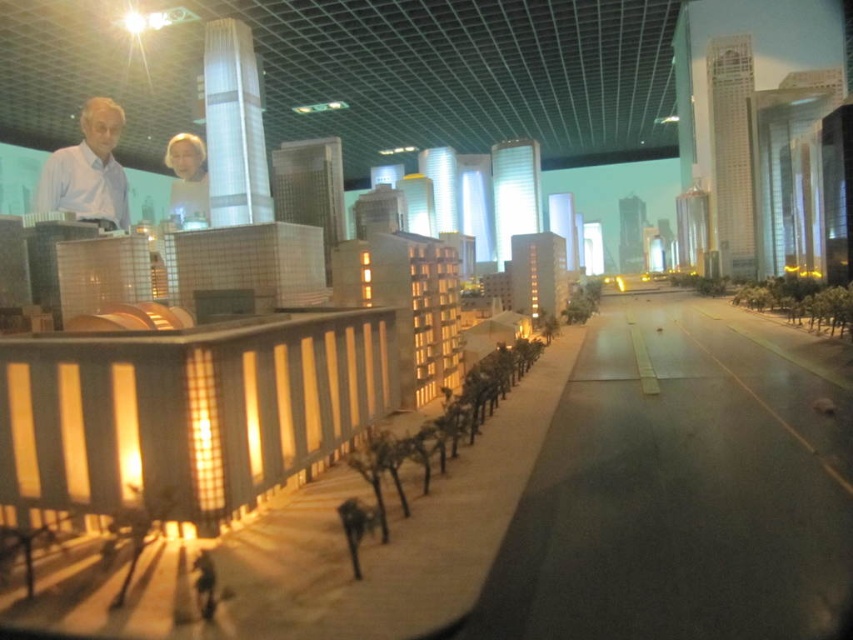
Question: Among these objects, which one is nearest to the camera?

Choices:
 (A) white shirt at left
 (B) matte white man at upper center

Answer: (A)

Question: Can you confirm if white shirt at left is smaller than matte white man at upper center?

Choices:
 (A) no
 (B) yes

Answer: (A)

Question: Can you confirm if white shirt at left is thinner than matte white man at upper center?

Choices:
 (A) yes
 (B) no

Answer: (B)

Question: Which point is closer to the camera taking this photo?

Choices:
 (A) (170, 209)
 (B) (103, 97)

Answer: (B)

Question: Does white shirt at left appear on the left side of matte white man at upper center?

Choices:
 (A) yes
 (B) no

Answer: (A)